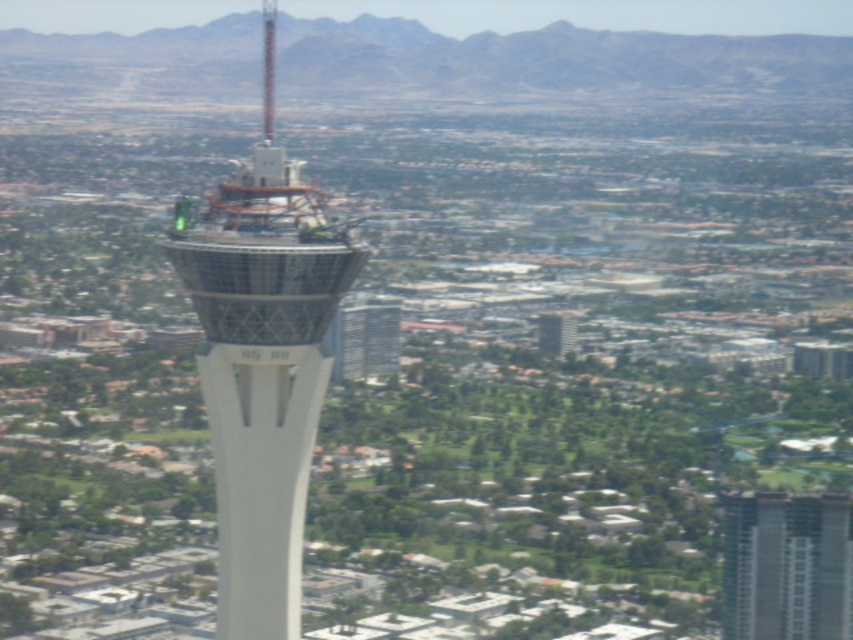
You are an architect evaluating the Stratosphere Tower and a nearby gray concrete building. Based on the scene, which structure has a greater width? Please refer to the white glass tower at center and the gray concrete building at center in your answer.

The white glass tower at center has a greater width than the gray concrete building at center.

Looking at this image, you are an architect reviewing the construction site of the white glass tower at center and the gray concrete building at center. Which structure is situated higher in elevation?

The white glass tower at center is positioned over the gray concrete building at center, so it is situated higher in elevation.